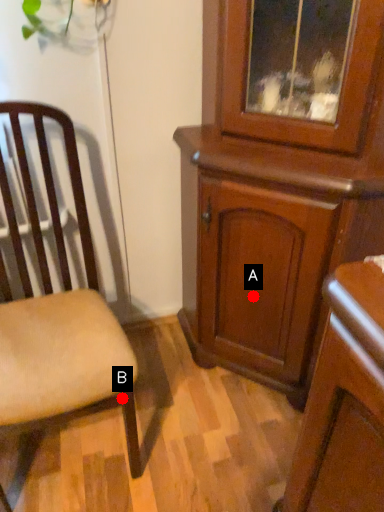
Question: Two points are circled on the image, labeled by A and B beside each circle. Which point is farther to the camera?

Choices:
 (A) A is further
 (B) B is further

Answer: (A)